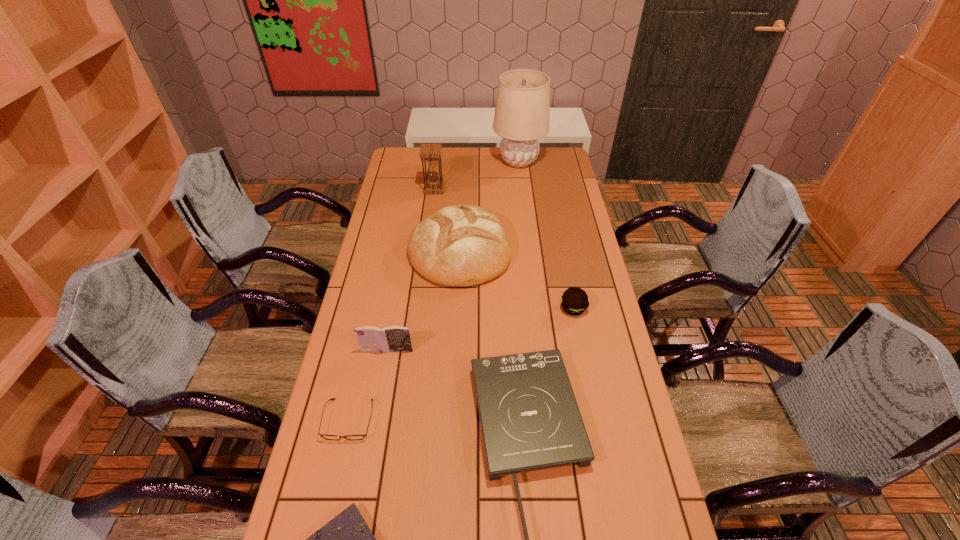
I want to click on free space located on the back of the seventh shortest object, so click(x=439, y=150).

Where is `free spot located on the right of the sixth nearest object`? free spot located on the right of the sixth nearest object is located at coordinates (592, 249).

Identify the location of free space located on the front cover of the book. The height and width of the screenshot is (540, 960). (364, 480).

At what (x,y) coordinates should I click in order to perform the action: click on free region located 0.050m on the right of the fifth nearest object. Please return your answer as a coordinate pair (x, y). Looking at the image, I should click on (602, 308).

Locate an element on the screen. The height and width of the screenshot is (540, 960). vacant space located on the front-facing side of the seventh tallest object is located at coordinates (333, 490).

Locate an element on the screen. This screenshot has width=960, height=540. object located at the far edge is located at coordinates (522, 114).

I want to click on bread situated at the left edge, so click(x=460, y=245).

You are a GUI agent. You are given a task and a screenshot of the screen. Output one action in this format:
    pyautogui.click(x=<x>, y=<y>)
    Task: Click on the book present at the left edge
    
    Given the screenshot: What is the action you would take?
    pyautogui.click(x=393, y=338)

The width and height of the screenshot is (960, 540). What are the coordinates of `spectacles situated at the left edge` in the screenshot? It's located at (328, 437).

Locate an element on the screen. lampshade that is at the right edge is located at coordinates (522, 114).